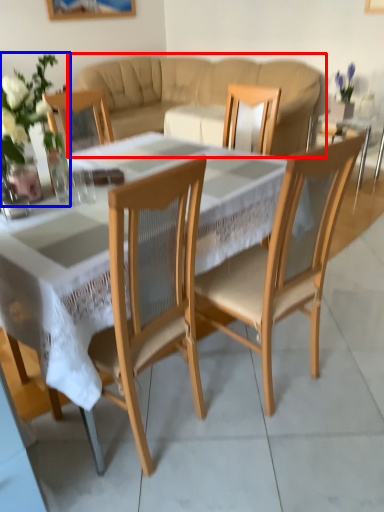
Question: Which of the following is the closest to the observer, studio couch (highlighted by a red box) or floral arrangement (highlighted by a blue box)?

Choices:
 (A) studio couch
 (B) floral arrangement

Answer: (B)